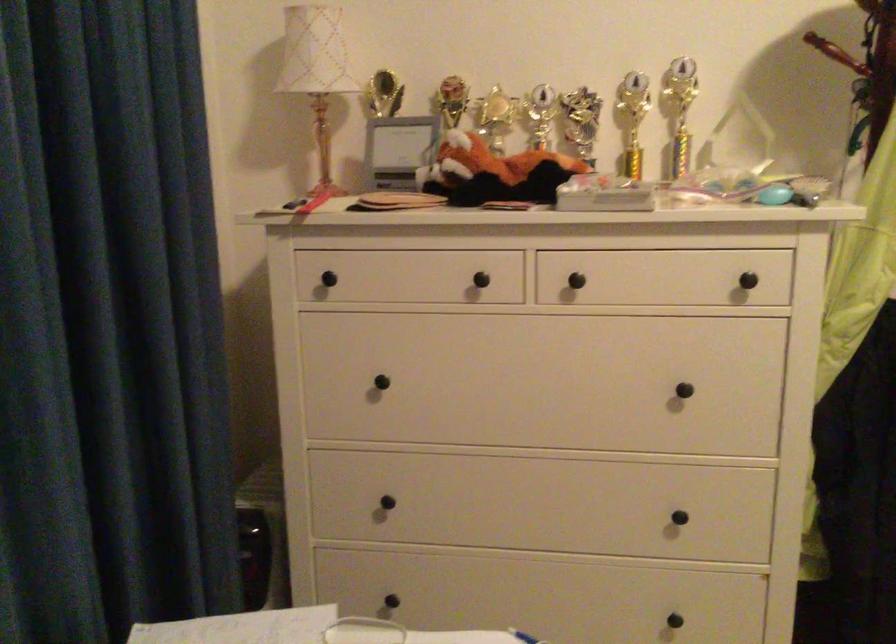
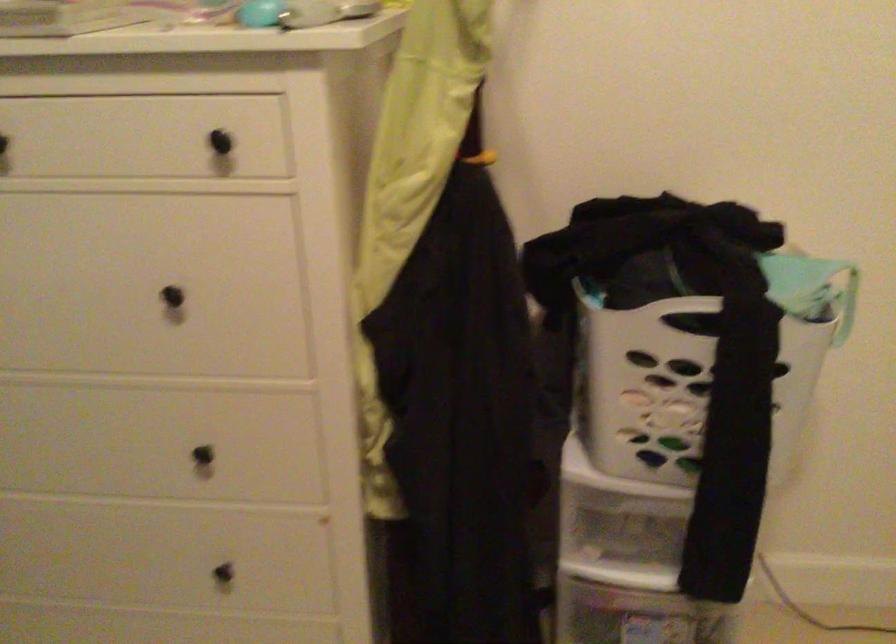
Locate, in the second image, the point that corresponds to point (745, 278) in the first image.

(220, 142)